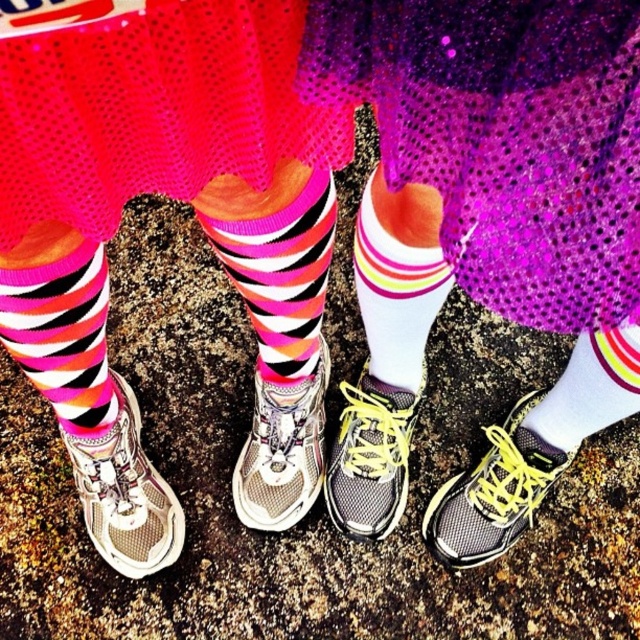
Is point (474, 272) positioned before point (131, 403)?

Yes.

Does purple sequined skirt at center appear over white mesh sneaker at lower left?

Correct, purple sequined skirt at center is located above white mesh sneaker at lower left.

Where is `purple sequined skirt at center`? The image size is (640, 640). purple sequined skirt at center is located at coordinates (504, 138).

Is multicolored striped sock at center wider than white striped sock at lower right?

Yes.

Is multicolored striped sock at center to the right of white striped sock at lower right from the viewer's perspective?

In fact, multicolored striped sock at center is to the left of white striped sock at lower right.

Where is `multicolored striped sock at center`? multicolored striped sock at center is located at coordinates (275, 259).

Image resolution: width=640 pixels, height=640 pixels. Identify the location of multicolored striped sock at center. (275, 259).

Does white matte sock at center have a larger size compared to white mesh sneaker at center?

Indeed, white matte sock at center has a larger size compared to white mesh sneaker at center.

Can you confirm if white matte sock at center is positioned below white mesh sneaker at center?

No.

Locate an element on the screen. white matte sock at center is located at coordinates (397, 276).

I want to click on white matte sock at center, so click(397, 276).